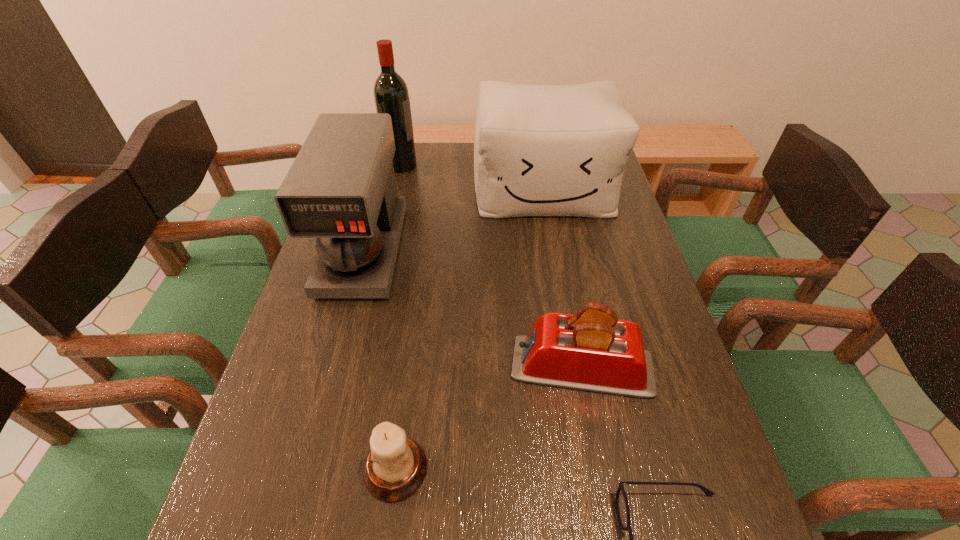
Where is `the tallest object`? The width and height of the screenshot is (960, 540). the tallest object is located at coordinates (391, 95).

At what (x,y) coordinates should I click in order to perform the action: click on cushion. Please return your answer as a coordinate pair (x, y). The image size is (960, 540). Looking at the image, I should click on (539, 150).

In order to click on coffee maker in this screenshot , I will do `click(341, 189)`.

You are a GUI agent. You are given a task and a screenshot of the screen. Output one action in this format:
    pyautogui.click(x=<x>, y=<y>)
    Task: Click on the toaster
    This screenshot has width=960, height=540.
    Given the screenshot: What is the action you would take?
    pyautogui.click(x=592, y=350)

Identify the location of the third nearest object. (592, 350).

Identify the location of the third object from left to right. (396, 466).

In order to click on the second shortest object in this screenshot , I will do coord(396,466).

Find the location of a particular element. This screenshot has width=960, height=540. vacant space located 0.380m on the label of the wine bottle is located at coordinates (525, 165).

Where is `vacant space situated on the side of the cushion with the smiley face`? The image size is (960, 540). vacant space situated on the side of the cushion with the smiley face is located at coordinates (553, 239).

I want to click on vacant space located 0.090m on the carafe side of the coffee maker, so click(x=342, y=330).